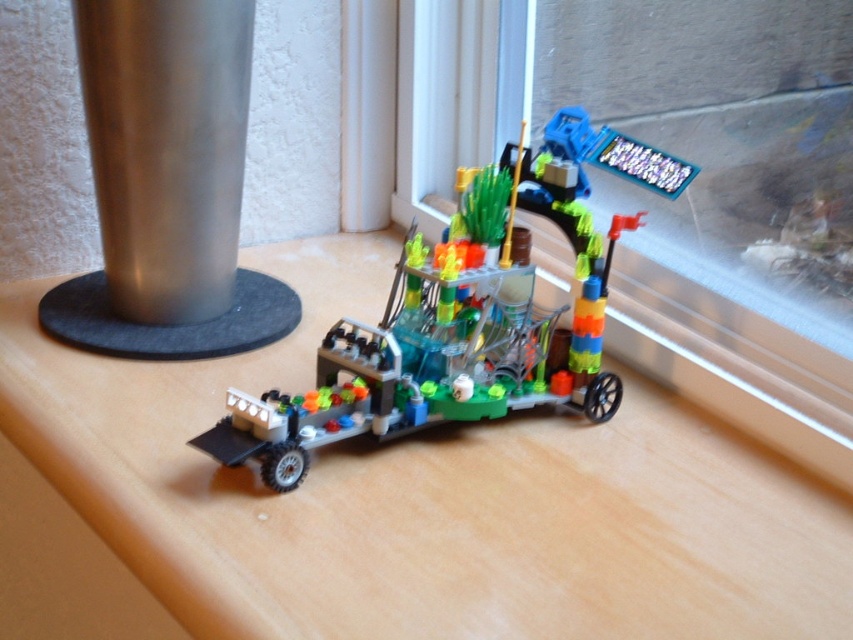
You are standing in front of a LEGO creation and want to touch the point at coordinates point (804, 524). If your hand can reach up to 28 inches, will you be able to reach it?

The distance between you and the point (804, 524) is 28.75 inches, which is slightly beyond your hand reach of 28 inches. Therefore, you cannot reach it.

You are a LEGO enthusiast examining the scene. You notice the transparent plastic window at upper right and the translucent plastic vehicle at center. Which object is positioned higher in the image?

The transparent plastic window at upper right is positioned higher than the translucent plastic vehicle at center.

In the scene shown: You are trying to place a large LEGO set on the wooden table at center and transparent plastic window at upper right. Which surface can accommodate the LEGO set better?

The wooden table at center is larger in size than the transparent plastic window at upper right, so the wooden table at center can accommodate the LEGO set better.